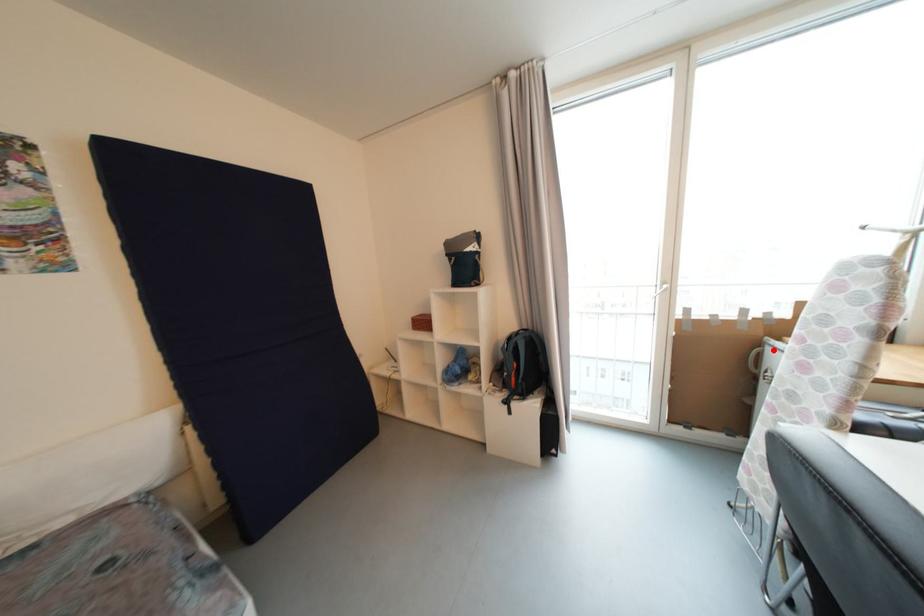
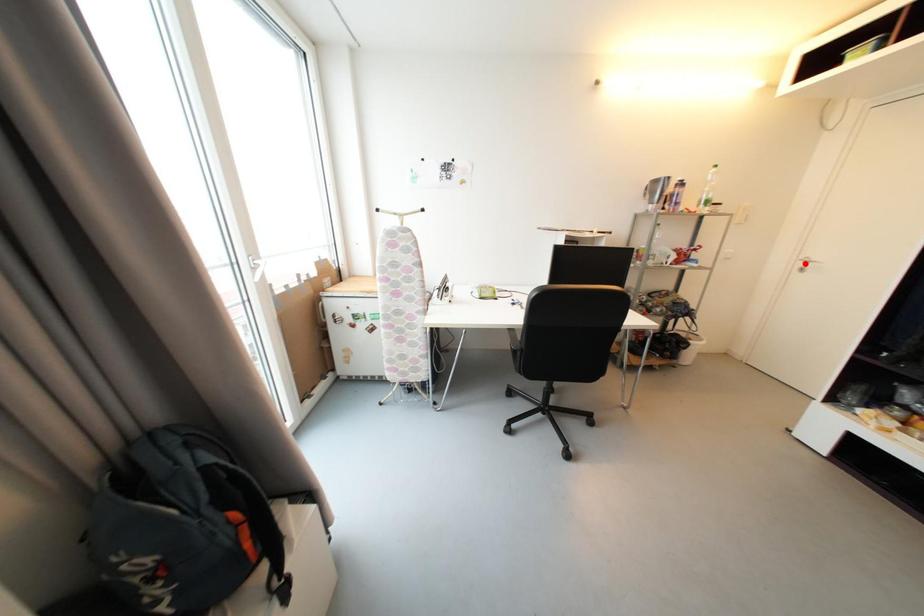
I am providing you with two images of the same scene from different viewpoints. A red point is marked on the first image and another point is marked on the second image. Is the red point in image1 aligned with the point shown in image2?

No